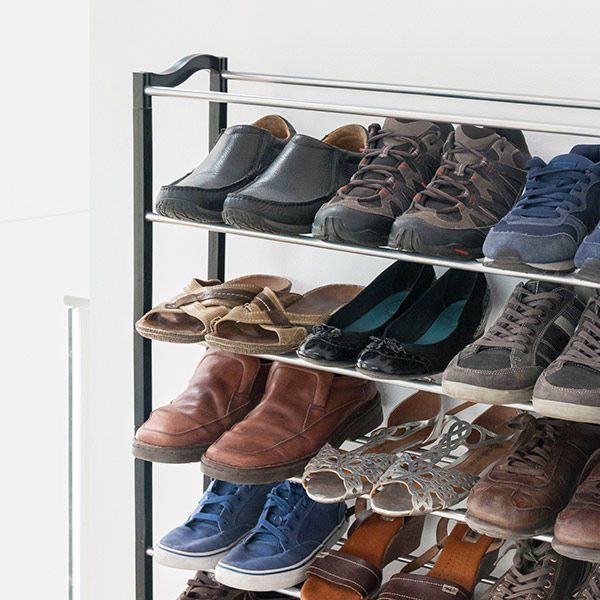
Identify the location of shoes fourth shelf. The width and height of the screenshot is (600, 600). (196, 304), (278, 314), (369, 341), (419, 341), (565, 369), (495, 355).